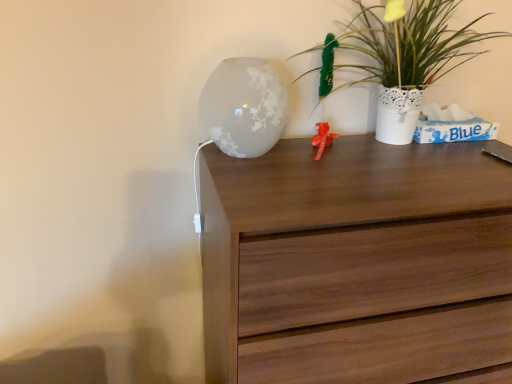
Locate an element on the screen. free region under white textured vase at upper right (from a real-world perspective) is located at coordinates (360, 140).